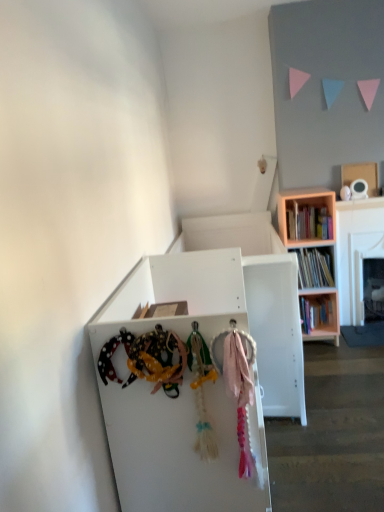
I want to click on pink fabric at center, so click(x=240, y=396).

Describe the element at coordinates (179, 393) in the screenshot. The width and height of the screenshot is (384, 512). I see `white matte cabinet at center` at that location.

You are a GUI agent. You are given a task and a screenshot of the screen. Output one action in this format:
    pyautogui.click(x=<x>, y=<y>)
    Task: Click on the wooden bookcase at upper right
    The height and width of the screenshot is (512, 384).
    Given the screenshot: What is the action you would take?
    pyautogui.click(x=311, y=256)

In the scene shown: Which is correct: wooden bookcase at upper right is inside wooden bookshelf at right, or outside of it?

wooden bookcase at upper right is not inside wooden bookshelf at right, it's outside.

You are a GUI agent. You are given a task and a screenshot of the screen. Output one action in this format:
    pyautogui.click(x=<x>, y=<y>)
    Task: Click on the book above the wooden bookcase at upper right (from the image's perspective)
    This screenshot has width=384, height=512.
    Given the screenshot: What is the action you would take?
    pyautogui.click(x=308, y=222)

Is wooden bookcase at upper right looking in the opposite direction of wooden bookshelf at right?

Yes, wooden bookcase at upper right is positioned with its back facing wooden bookshelf at right.

Is point (121, 392) positioned after point (321, 298)?

That is False.

Is white matte cabinet at center touching wooden bookcase at upper right?

white matte cabinet at center and wooden bookcase at upper right are not in contact.

Is white matte cabinet at center taller or shorter than wooden bookcase at upper right?

white matte cabinet at center is shorter than wooden bookcase at upper right.

Is white matte cabinet at center facing away from wooden bookcase at upper right?

That's not correct — white matte cabinet at center is not looking away from wooden bookcase at upper right.

This screenshot has width=384, height=512. What are the coordinates of `cardboard box on the right of white matte cabinet at center` in the screenshot? It's located at (361, 175).

From the image's perspective, does cardboard box at upper right appear lower than white matte cabinet at center?

No, from the image's perspective, cardboard box at upper right is not beneath white matte cabinet at center.

Is cardboard box at upper right touching white matte cabinet at center?

No, cardboard box at upper right is not beside white matte cabinet at center.

In order to click on bookcase that is below the cardboard box at upper right (from the image's perspective) in this screenshot , I will do `click(311, 256)`.

From the image's perspective, is wooden bookcase at upper right positioned above or below cardboard box at upper right?

wooden bookcase at upper right is below cardboard box at upper right.

Is wooden bookcase at upper right to the left of cardboard box at upper right from the viewer's perspective?

Correct, you'll find wooden bookcase at upper right to the left of cardboard box at upper right.

Which is farther from the camera, (298, 197) or (375, 178)?

The point (375, 178) is more distant.

Is wooden bookshelf at right not within white matte cabinet at center?

wooden bookshelf at right is positioned outside white matte cabinet at center.

What's the angular difference between wooden bookshelf at right and white matte cabinet at center's facing directions?

There is a 90.3-degree angle between the facing directions of wooden bookshelf at right and white matte cabinet at center.

Is wooden bookshelf at right at the right side of white matte cabinet at center?

Indeed, wooden bookshelf at right is positioned on the right side of white matte cabinet at center.

Does wooden bookshelf at right have a greater width compared to white matte cabinet at center?

No, wooden bookshelf at right is not wider than white matte cabinet at center.

Are wooden bookshelf at right and cardboard box at upper right far apart?

wooden bookshelf at right is actually quite close to cardboard box at upper right.

Which is in front, wooden bookshelf at right or cardboard box at upper right?

wooden bookshelf at right is closer to the camera.

In the scene shown: Between wooden bookshelf at right and cardboard box at upper right, which one has smaller size?

Smaller between the two is cardboard box at upper right.

Looking at this image, which is nearer, (308, 209) or (342, 170)?

Point (308, 209)

From the picture: From a real-world perspective, who is located higher, pink fabric at center or wooden bookshelf at right?

From a 3D spatial view, wooden bookshelf at right is above.

This screenshot has height=512, width=384. What are the coordinates of `book above the pink fabric at center (from the image's perspective)` in the screenshot? It's located at (308, 222).

Is pink fabric at center oriented towards wooden bookshelf at right?

No, pink fabric at center is not facing towards wooden bookshelf at right.

At what (x,y) coordinates should I click in order to perform the action: click on book above the wooden bookcase at upper right (from a real-world perspective). Please return your answer as a coordinate pair (x, y). The width and height of the screenshot is (384, 512). Looking at the image, I should click on (308, 222).

Locate an element on the screen. The image size is (384, 512). bookcase on the right side of white matte cabinet at center is located at coordinates (311, 256).

From the image, which object appears to be nearer to white matte cabinet at center, wooden bookcase at upper right or wooden bookshelf at right?

Among the two, wooden bookcase at upper right is located nearer to white matte cabinet at center.

From the image, which object appears to be nearer to white matte cabinet at center, wooden bookshelf at right or pink fabric at center?

pink fabric at center is closer to white matte cabinet at center.

Looking at the image, which one is located closer to wooden bookshelf at right, wooden bookcase at upper right or cardboard box at upper right?

wooden bookcase at upper right lies closer to wooden bookshelf at right than the other object.

Looking at this image, when comparing their distances from pink fabric at center, does white matte cabinet at center or wooden bookcase at upper right seem closer?

white matte cabinet at center is positioned closer to the anchor pink fabric at center.

Which object lies nearer to the anchor point wooden bookshelf at right, pink fabric at center or wooden bookcase at upper right?

wooden bookcase at upper right is closer to wooden bookshelf at right.

In the scene shown: From the image, which object appears to be farther from cardboard box at upper right, wooden bookshelf at right or wooden bookcase at upper right?

wooden bookcase at upper right is positioned further to the anchor cardboard box at upper right.

When comparing their distances from pink fabric at center, does wooden bookcase at upper right or white matte cabinet at center seem further?

The object further to pink fabric at center is wooden bookcase at upper right.

When comparing their distances from white matte cabinet at center, does pink fabric at center or wooden bookshelf at right seem closer?

pink fabric at center lies closer to white matte cabinet at center than the other object.

Identify the location of book between pink fabric at center and cardboard box at upper right from front to back. The width and height of the screenshot is (384, 512). (308, 222).

Identify the location of cabinetry positioned between pink fabric at center and wooden bookshelf at right from near to far. (179, 393).

Identify the location of book that lies between cardboard box at upper right and wooden bookcase at upper right from top to bottom. (308, 222).

Where is `bookcase located between white matte cabinet at center and wooden bookshelf at right in the depth direction`? bookcase located between white matte cabinet at center and wooden bookshelf at right in the depth direction is located at coordinates (311, 256).